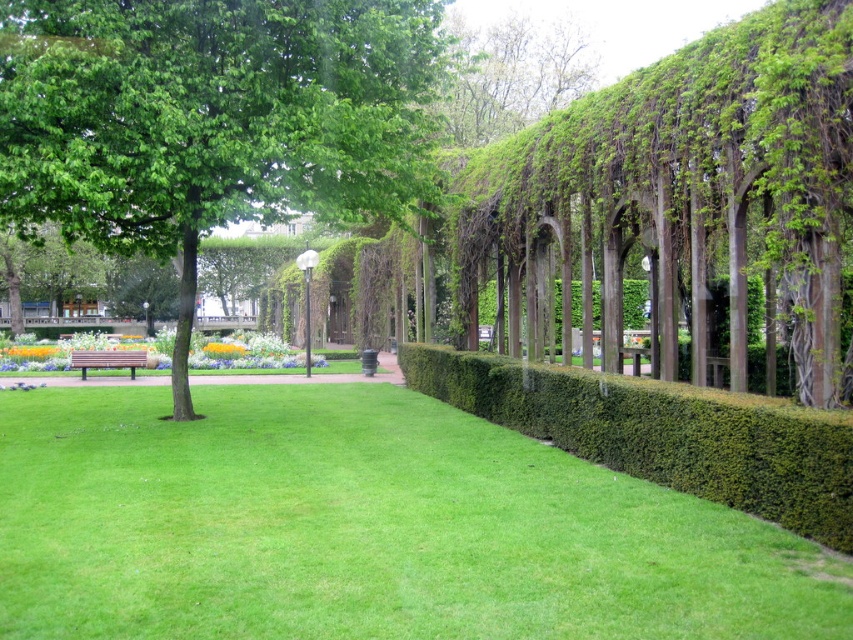
Is green grassy at center to the right of green leafy tree at center from the viewer's perspective?

No, green grassy at center is not to the right of green leafy tree at center.

Looking at this image, who is higher up, green grassy at center or green leafy tree at center?

green leafy tree at center is above.

What do you see at coordinates (364, 528) in the screenshot? The height and width of the screenshot is (640, 853). I see `green grassy at center` at bounding box center [364, 528].

Where is `green grassy at center`? green grassy at center is located at coordinates (364, 528).

Can you confirm if green dense hedge at right is wider than yellow matte flower at center?

Indeed, green dense hedge at right has a greater width compared to yellow matte flower at center.

Is green dense hedge at right to the right of yellow matte flower at center from the viewer's perspective?

Indeed, green dense hedge at right is positioned on the right side of yellow matte flower at center.

This screenshot has height=640, width=853. What do you see at coordinates (663, 433) in the screenshot? I see `green dense hedge at right` at bounding box center [663, 433].

Find the location of a particular element. The image size is (853, 640). green dense hedge at right is located at coordinates [663, 433].

Between green grassy at center and green leafy tree at upper center, which one appears on the left side from the viewer's perspective?

Positioned to the left is green grassy at center.

Is green grassy at center taller than green leafy tree at upper center?

Incorrect, green grassy at center's height is not larger of green leafy tree at upper center's.

I want to click on green grassy at center, so click(x=364, y=528).

Identify the location of green grassy at center. (364, 528).